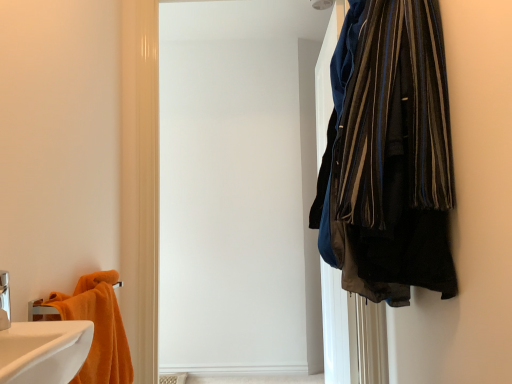
Question: From a real-world perspective, is white matte screen door at upper right below orange cotton towel at lower left?

Choices:
 (A) no
 (B) yes

Answer: (A)

Question: Considering the relative sizes of white matte screen door at upper right and orange cotton towel at lower left in the image provided, is white matte screen door at upper right thinner than orange cotton towel at lower left?

Choices:
 (A) yes
 (B) no

Answer: (A)

Question: Can you confirm if white matte screen door at upper right is shorter than orange cotton towel at lower left?

Choices:
 (A) no
 (B) yes

Answer: (A)

Question: Can you confirm if white matte screen door at upper right is bigger than orange cotton towel at lower left?

Choices:
 (A) yes
 (B) no

Answer: (A)

Question: Considering the relative sizes of white matte screen door at upper right and orange cotton towel at lower left in the image provided, is white matte screen door at upper right wider than orange cotton towel at lower left?

Choices:
 (A) no
 (B) yes

Answer: (A)

Question: Is orange cotton towel at lower left surrounded by white matte screen door at upper right?

Choices:
 (A) no
 (B) yes

Answer: (A)

Question: From a real-world perspective, is white glossy sink at lower left under white matte screen door at upper right?

Choices:
 (A) yes
 (B) no

Answer: (A)

Question: Does white glossy sink at lower left have a smaller size compared to white matte screen door at upper right?

Choices:
 (A) yes
 (B) no

Answer: (A)

Question: Does white glossy sink at lower left have a greater width compared to white matte screen door at upper right?

Choices:
 (A) no
 (B) yes

Answer: (B)

Question: Could you tell me if white glossy sink at lower left is facing white matte screen door at upper right?

Choices:
 (A) yes
 (B) no

Answer: (B)

Question: Can you confirm if white glossy sink at lower left is thinner than white matte screen door at upper right?

Choices:
 (A) yes
 (B) no

Answer: (B)

Question: Considering the relative sizes of white glossy sink at lower left and white matte screen door at upper right in the image provided, is white glossy sink at lower left shorter than white matte screen door at upper right?

Choices:
 (A) no
 (B) yes

Answer: (B)

Question: Is white matte screen door at upper right turned away from white glossy sink at lower left?

Choices:
 (A) yes
 (B) no

Answer: (B)